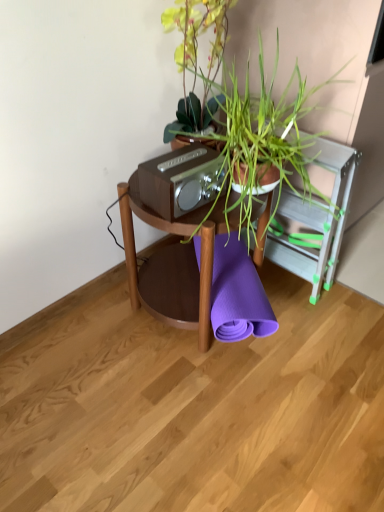
Locate an element on the screen. This screenshot has width=384, height=512. vacant space that is to the left of woodenmaterial/texturetable at center is located at coordinates (92, 335).